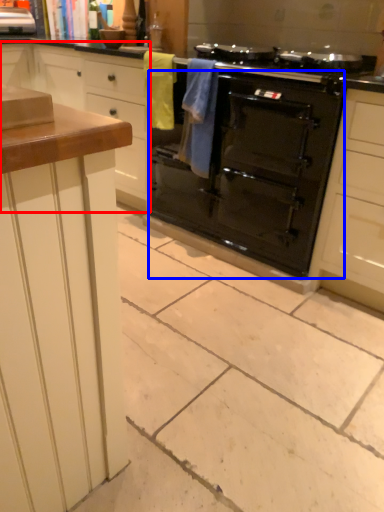
Question: Which of the following is the closest to the observer, cabinetry (highlighted by a red box) or oven (highlighted by a blue box)?

Choices:
 (A) cabinetry
 (B) oven

Answer: (B)